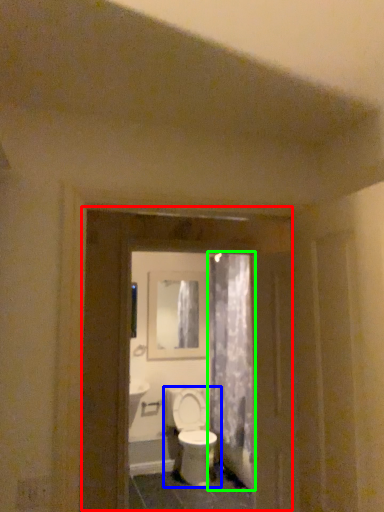
Question: Based on their relative distances, which object is nearer to screen door (highlighted by a red box)? Choose from toilet (highlighted by a blue box) and shower curtain (highlighted by a green box).

Choices:
 (A) toilet
 (B) shower curtain

Answer: (B)